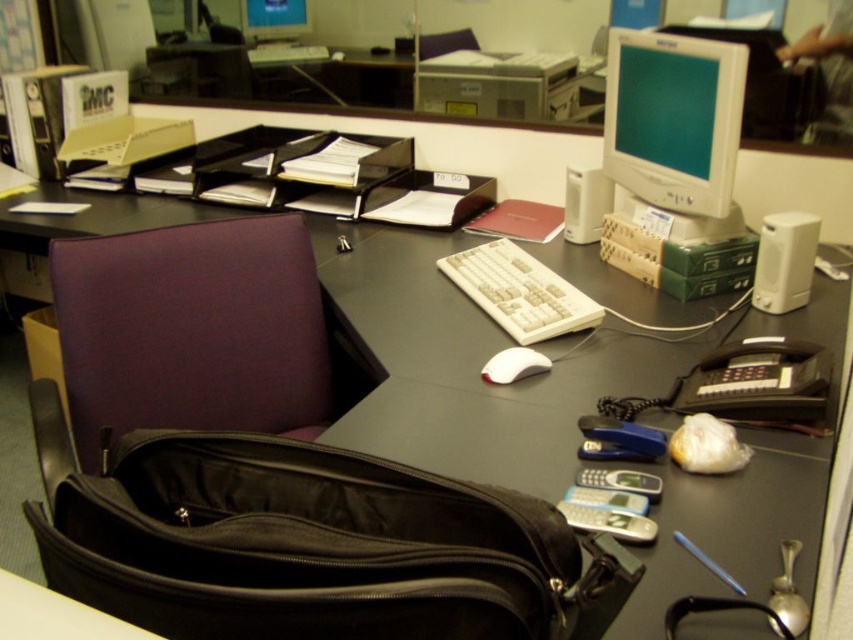
Question: Which of the following is the farthest from the observer?

Choices:
 (A) matte plastic monitor at upper right
 (B) white matte keyboard at center
 (C) white plastic keyboard at center

Answer: (B)

Question: Does white plastic keyboard at center come in front of matte plastic monitor at upper center?

Choices:
 (A) yes
 (B) no

Answer: (A)

Question: Can you confirm if matte plastic monitor at upper right is smaller than white matte keyboard at center?

Choices:
 (A) no
 (B) yes

Answer: (A)

Question: Which object is farther from the camera taking this photo?

Choices:
 (A) matte plastic monitor at upper center
 (B) white plastic keyboard at center
 (C) white matte keyboard at center

Answer: (C)

Question: Is matte plastic monitor at upper right positioned in front of white plastic keyboard at center?

Choices:
 (A) no
 (B) yes

Answer: (B)

Question: Which object appears closest to the camera in this image?

Choices:
 (A) black fabric bag at lower left
 (B) white matte keyboard at center

Answer: (A)